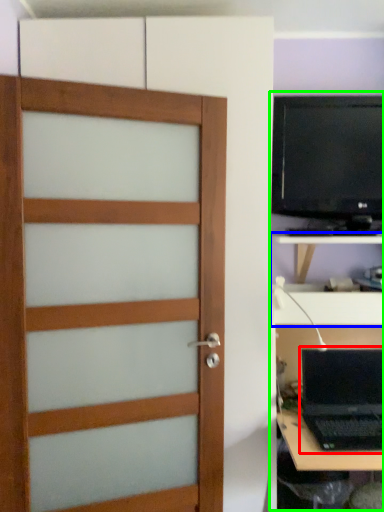
Question: Which object is the farthest from laptop (highlighted by a red box)? Choose among these: tv cabinet (highlighted by a blue box) or entertainment center (highlighted by a green box).

Choices:
 (A) tv cabinet
 (B) entertainment center

Answer: (B)